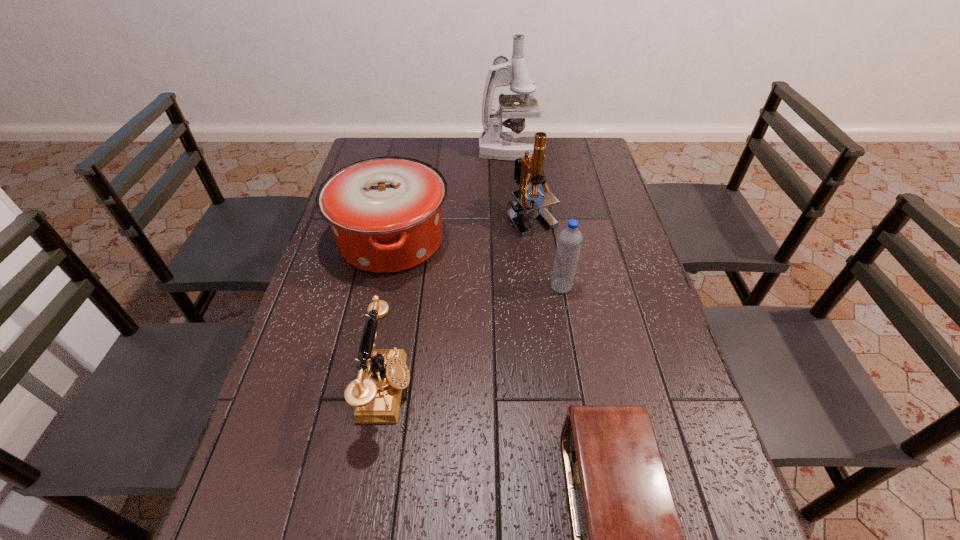
Identify the location of free point between the casserole and the water bottle. This screenshot has width=960, height=540. click(476, 264).

Where is `free spot between the fifth tallest object and the farther microscope`? The width and height of the screenshot is (960, 540). free spot between the fifth tallest object and the farther microscope is located at coordinates (448, 270).

Locate an element on the screen. The width and height of the screenshot is (960, 540). free spot between the casserole and the shorter microscope is located at coordinates (462, 229).

Identify the location of free space between the casserole and the telephone. (389, 315).

Where is `vacant space that is in between the nearer microscope and the casserole`? This screenshot has height=540, width=960. vacant space that is in between the nearer microscope and the casserole is located at coordinates (462, 229).

At what (x,y) coordinates should I click in order to perform the action: click on vacant region between the water bottle and the telephone. Please return your answer as a coordinate pair (x, y). Looking at the image, I should click on (474, 338).

The image size is (960, 540). Find the location of `object that stands as the second closest to the water bottle`. object that stands as the second closest to the water bottle is located at coordinates (385, 213).

Identify which object is the fifth closest to the second shortest object. Please provide its 2D coordinates. Your answer should be formatted as a tuple, i.e. [(x, y)], where the tuple contains the x and y coordinates of a point satisfying the conditions above.

[(493, 143)]

Identify the location of vacant space that satisfies the following two spatial constraints: 1. at the eyepiece of the water bottle; 2. on the left side of the shorter microscope. (540, 287).